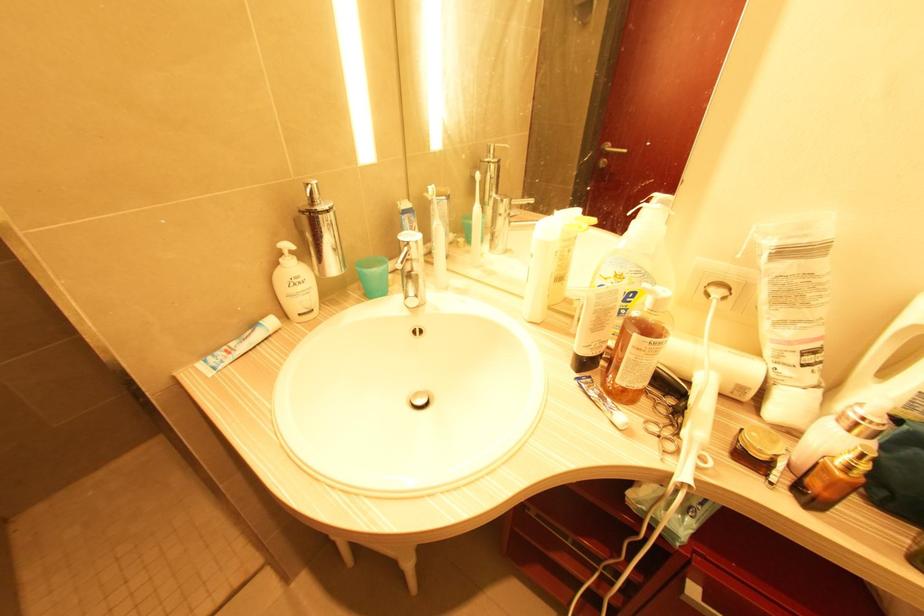
What do you see at coordinates (295, 285) in the screenshot?
I see `the white soap dispenser pump` at bounding box center [295, 285].